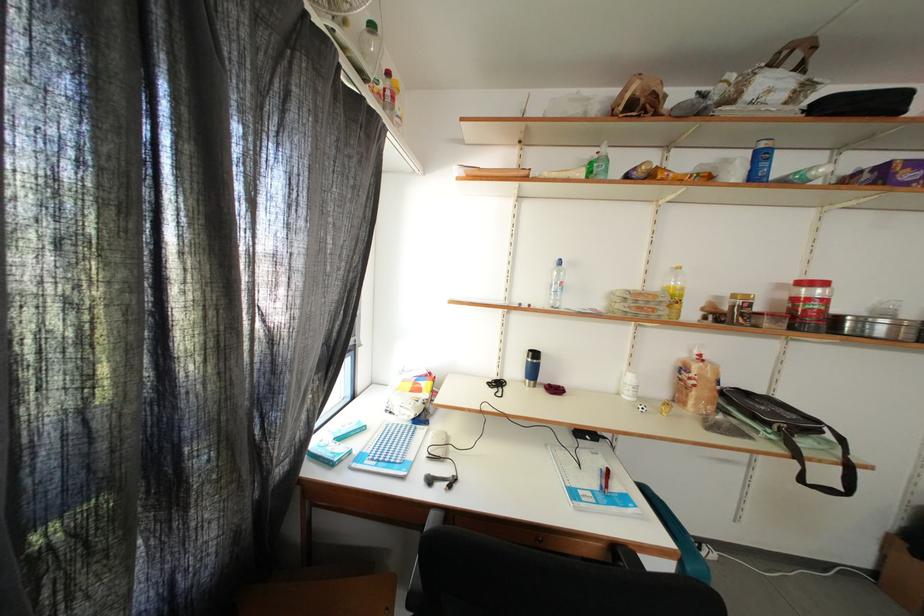
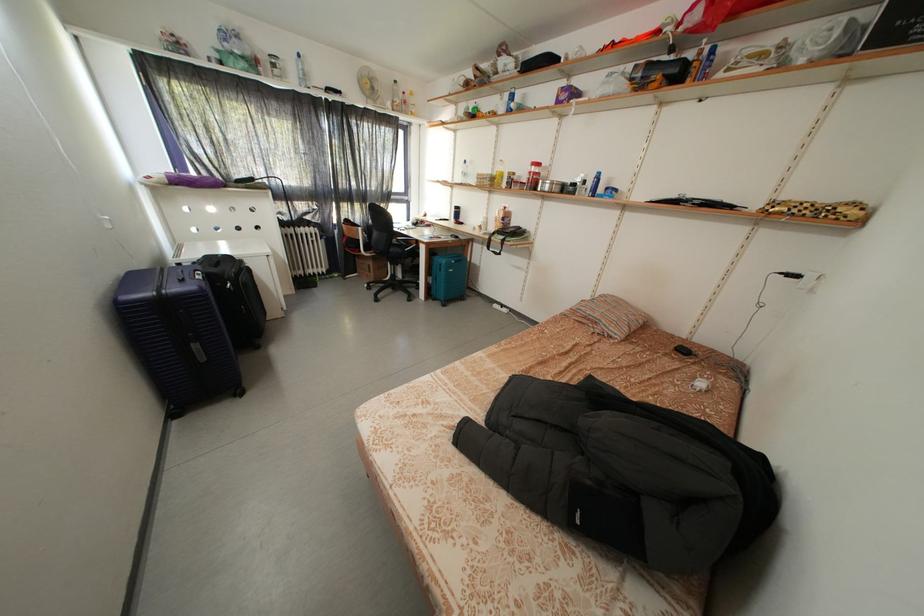
Find the pixel in the second image that matches [568,268] in the first image.

(472, 167)